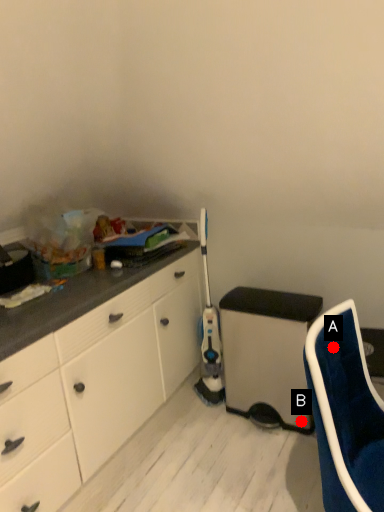
Question: Two points are circled on the image, labeled by A and B beside each circle. Which point appears closest to the camera in this image?

Choices:
 (A) A is closer
 (B) B is closer

Answer: (A)